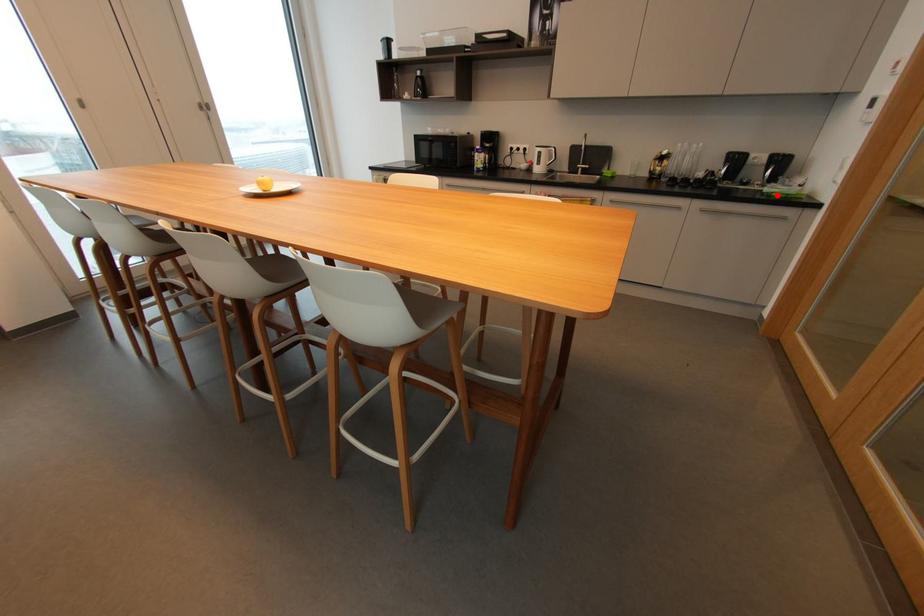
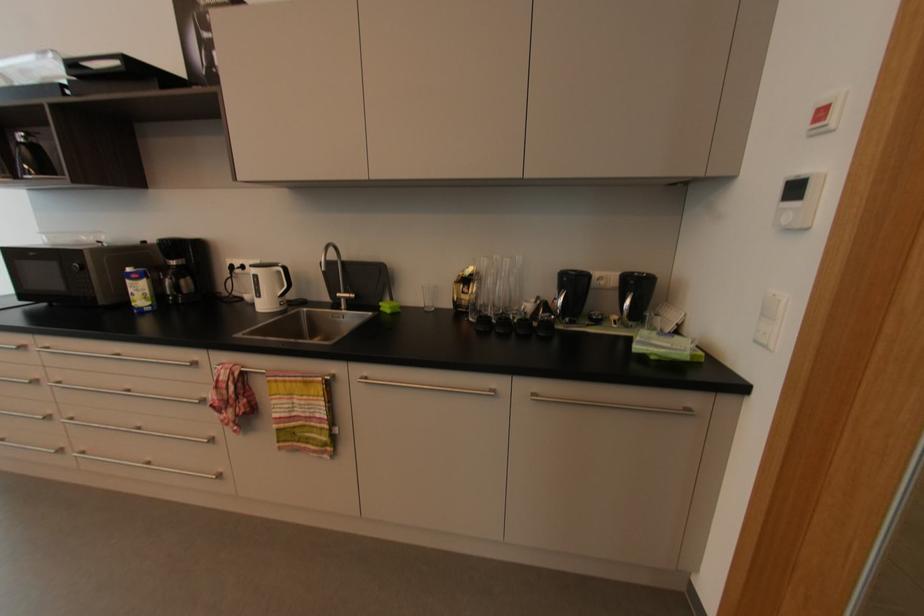
Where in the second image is the point corresponding to the highlighted location from the first image?

(657, 358)